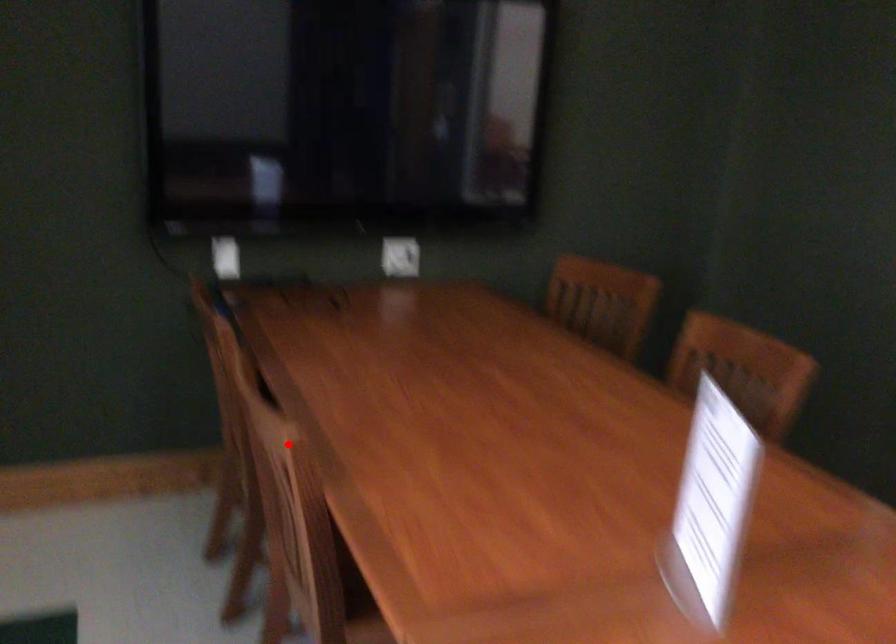
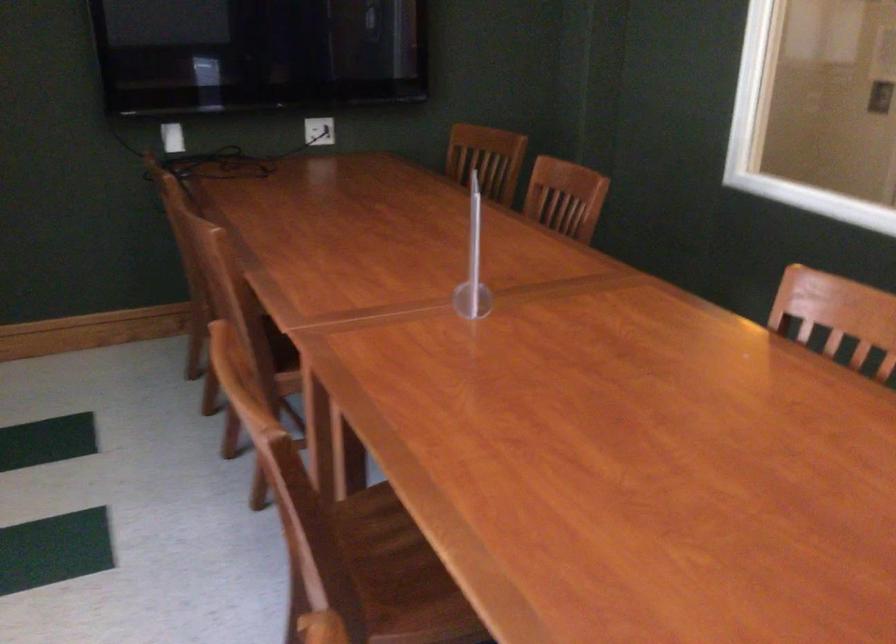
Question: I am providing you with two images of the same scene from different viewpoints. A red point is shown in image1. For the corresponding object point in image2, is it positioned nearer or farther from the camera?

Choices:
 (A) Nearer
 (B) Farther

Answer: (B)